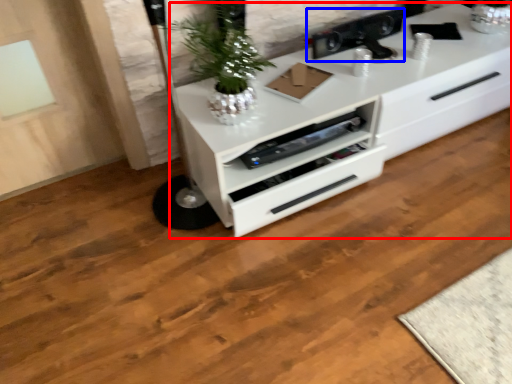
Question: Which object appears farthest to the camera in this image, chest of drawers (highlighted by a red box) or appliance (highlighted by a blue box)?

Choices:
 (A) chest of drawers
 (B) appliance

Answer: (B)